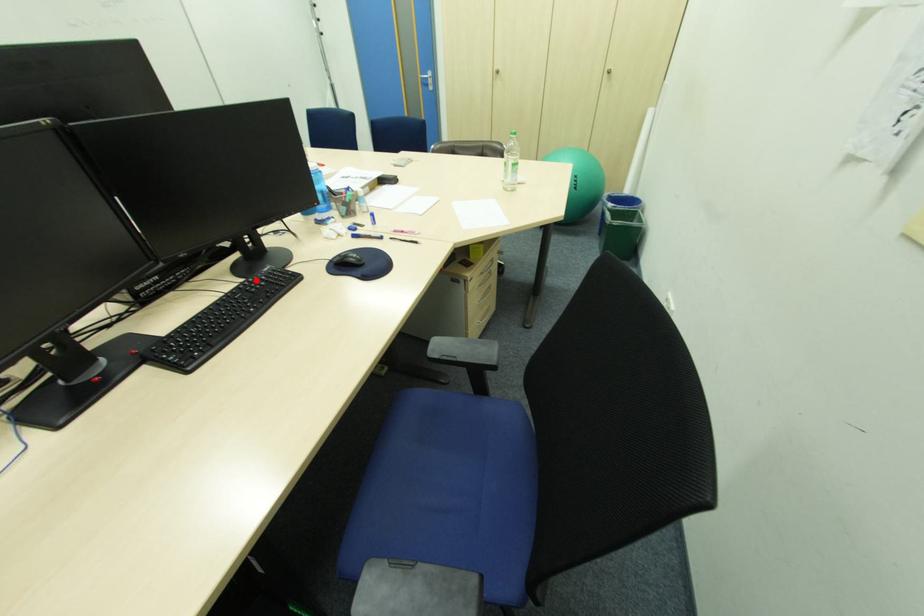
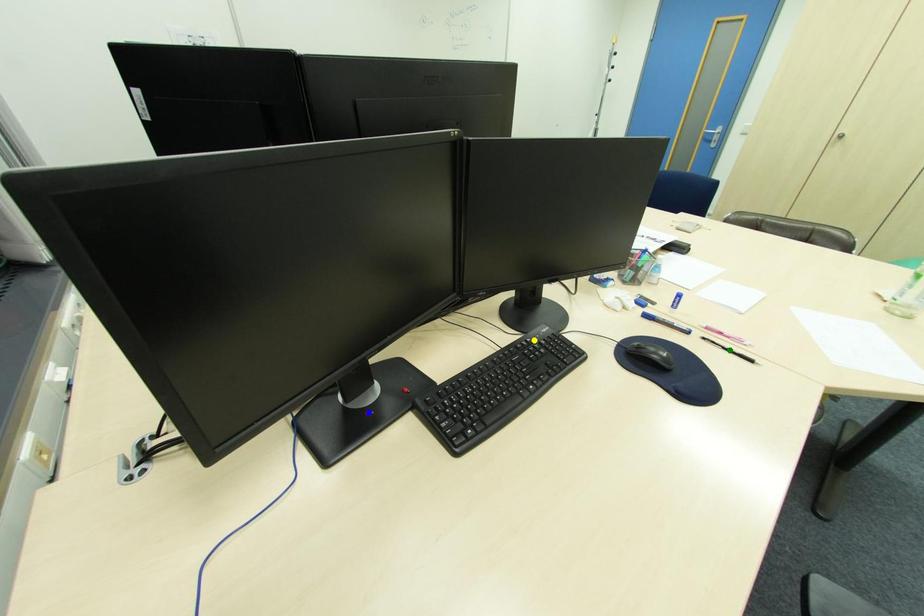
Question: I am providing you with two images of the same scene from different viewpoints. A red point is marked on the first image. You are given multiple points on the second image. Can you choose the point in image 2 that corresponds to the point in image 1?

Choices:
 (A) yellow point
 (B) green point
 (C) blue point

Answer: (A)